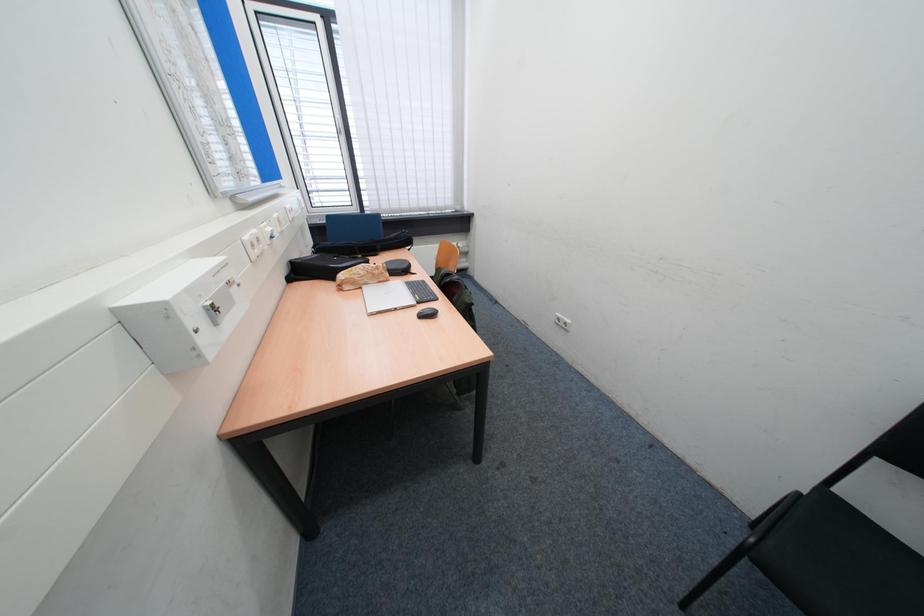
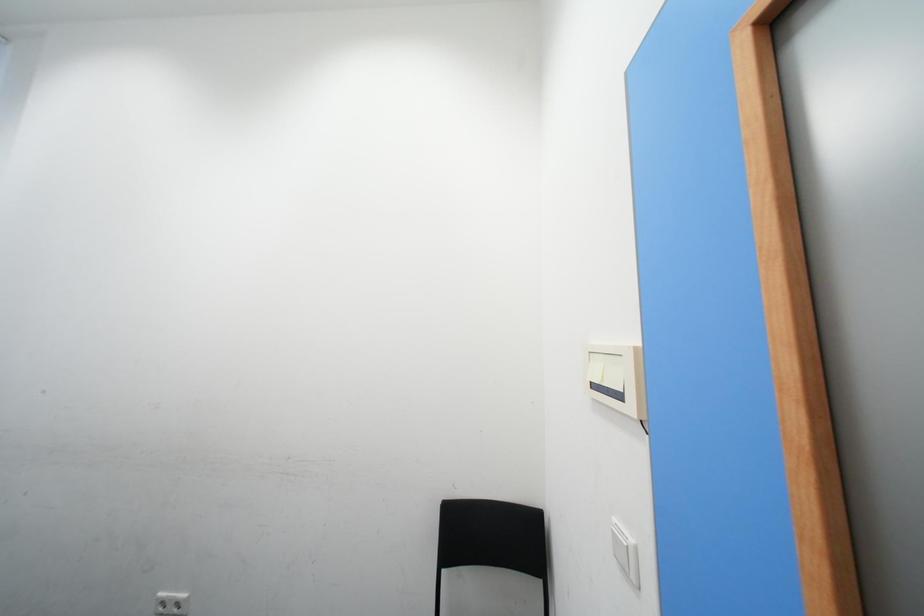
How did the camera likely rotate?

The camera's rotation is toward right-up.